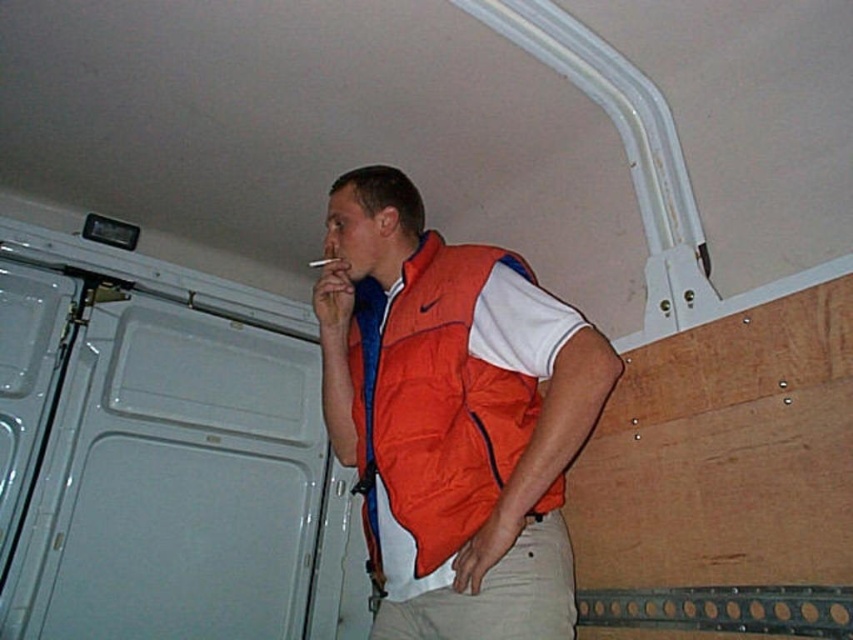
Question: Which point is farther from the camera taking this photo?

Choices:
 (A) (315, 264)
 (B) (376, 364)

Answer: (A)

Question: Which of the following is the closest to the observer?

Choices:
 (A) smooth brown cigarette at upper center
 (B) khaki cotton pants at lower center
 (C) orange puffer vest at center

Answer: (B)

Question: Can you confirm if khaki cotton pants at lower center is positioned above smooth brown cigarette at upper center?

Choices:
 (A) no
 (B) yes

Answer: (A)

Question: Does orange puffer vest at center come in front of khaki cotton pants at lower center?

Choices:
 (A) yes
 (B) no

Answer: (B)

Question: Does orange puffer vest at center appear over khaki cotton pants at lower center?

Choices:
 (A) yes
 (B) no

Answer: (A)

Question: Which of the following is the closest to the observer?

Choices:
 (A) (399, 608)
 (B) (314, 264)

Answer: (A)